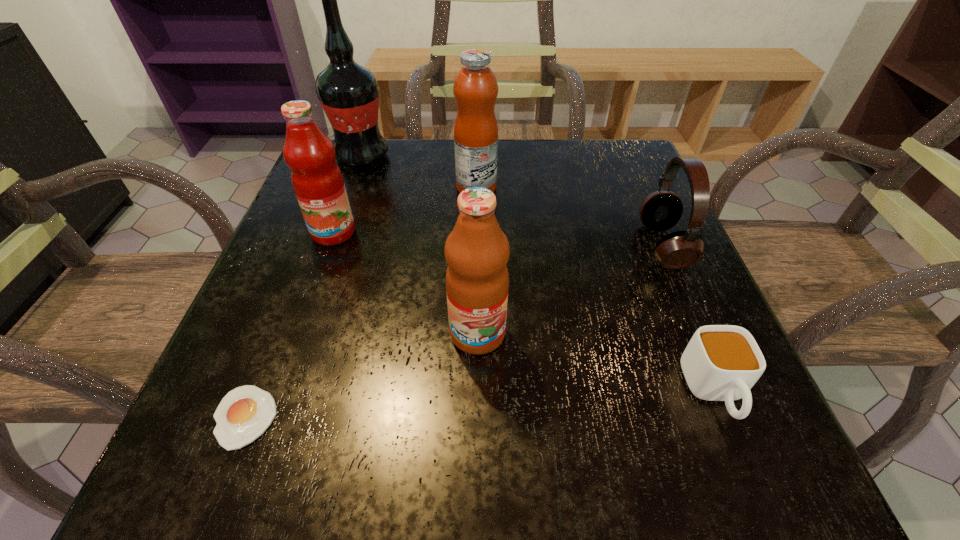
Identify the location of vacant space that satisfies the following two spatial constraints: 1. on the front label of the farthest fruit juice; 2. on the front label of the leftmost fruit juice. (476, 233).

The height and width of the screenshot is (540, 960). Find the location of `vacant area in the image that satisfies the following two spatial constraints: 1. on the ear pads of the headset; 2. on the front label of the nearest fruit juice`. vacant area in the image that satisfies the following two spatial constraints: 1. on the ear pads of the headset; 2. on the front label of the nearest fruit juice is located at coordinates (702, 334).

This screenshot has width=960, height=540. What are the coordinates of `free region that satisfies the following two spatial constraints: 1. on the ear pads of the fifth tallest object; 2. on the front label of the nearest fruit juice` in the screenshot? It's located at (702, 334).